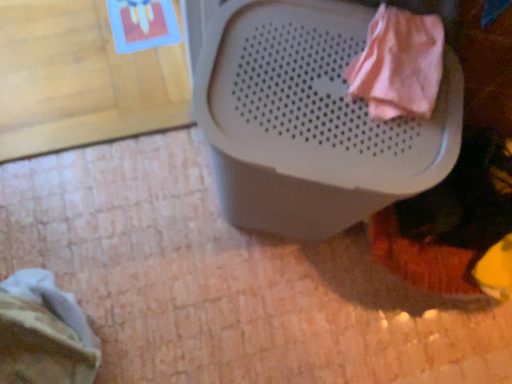
Where is `free spot in front of pink fabric at upper right, which appears as the 1th clothing when viewed from the right`? The width and height of the screenshot is (512, 384). free spot in front of pink fabric at upper right, which appears as the 1th clothing when viewed from the right is located at coordinates (362, 153).